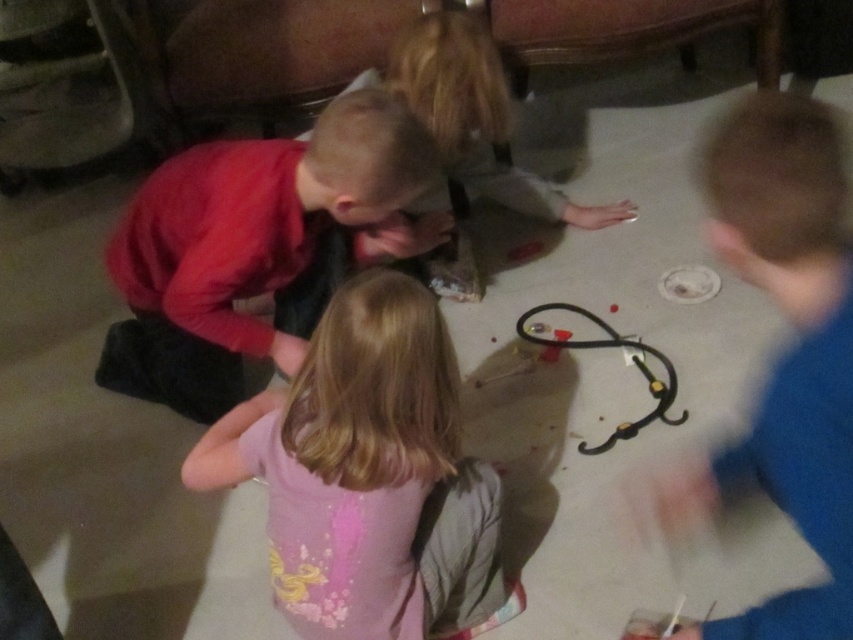
Question: Which object appears closest to the camera in this image?

Choices:
 (A) pink fabric shirt at center
 (B) black rubber train at center
 (C) red matte shirt at center

Answer: (A)

Question: Is pink fabric shirt at center to the left of black rubber train at center from the viewer's perspective?

Choices:
 (A) no
 (B) yes

Answer: (B)

Question: Is red matte shirt at center positioned at the back of black rubber train at center?

Choices:
 (A) yes
 (B) no

Answer: (B)

Question: Which of the following is the closest to the observer?

Choices:
 (A) (614, 339)
 (B) (444, 387)
 (C) (114, 371)

Answer: (B)

Question: Is pink fabric shirt at center smaller than black rubber train at center?

Choices:
 (A) yes
 (B) no

Answer: (B)

Question: Based on their relative distances, which object is nearer to the pink fabric shirt at center?

Choices:
 (A) red matte shirt at center
 (B) black rubber train at center

Answer: (A)